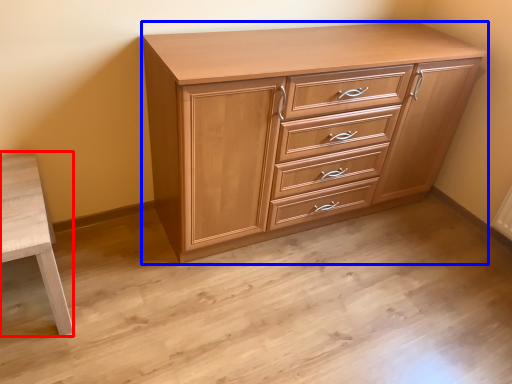
Question: Among these objects, which one is farthest to the camera, table (highlighted by a red box) or chest of drawers (highlighted by a blue box)?

Choices:
 (A) table
 (B) chest of drawers

Answer: (B)